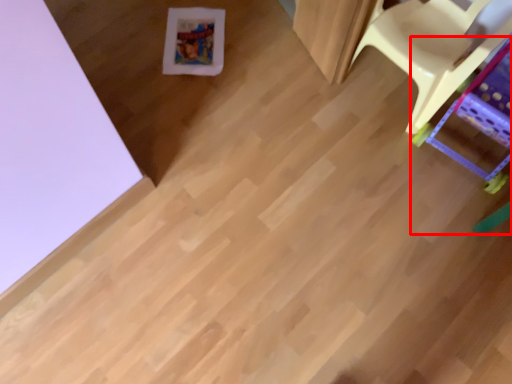
Question: Where is furniture (annotated by the red box) located in relation to furniture in the image?

Choices:
 (A) left
 (B) right

Answer: (B)